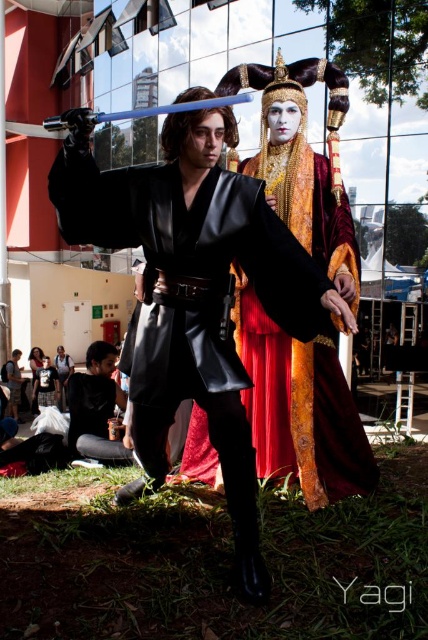
In the scene shown: Can you confirm if smooth gold dress at center is bigger than matte black dress at lower left?

No, smooth gold dress at center is not bigger than matte black dress at lower left.

The height and width of the screenshot is (640, 428). I want to click on smooth gold dress at center, so click(62, 372).

Is black leather jacket at lower left smaller than matte black dress at lower left?

Actually, black leather jacket at lower left might be larger than matte black dress at lower left.

Who is positioned more to the left, black leather jacket at lower left or matte black dress at lower left?

matte black dress at lower left is more to the left.

Who is more distant from viewer, (94, 376) or (35, 358)?

The point (35, 358) is more distant.

Identify the location of black leather jacket at lower left. Image resolution: width=428 pixels, height=640 pixels. (95, 406).

Measure the distance from matte black kimono at center to matte black dress at lower left.

116.14 feet

Is matte black kimono at center thinner than matte black dress at lower left?

No.

You are a GUI agent. You are given a task and a screenshot of the screen. Output one action in this format:
    pyautogui.click(x=<x>, y=<y>)
    Task: Click on the matte black kimono at center
    
    Given the screenshot: What is the action you would take?
    pyautogui.click(x=300, y=406)

Locate an element on the screen. The height and width of the screenshot is (640, 428). matte black kimono at center is located at coordinates (300, 406).